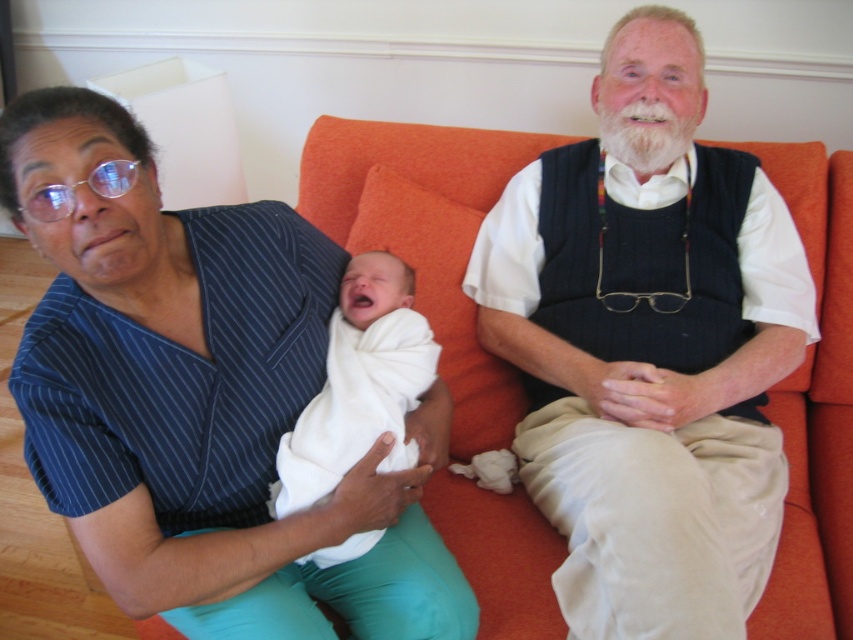
You are a photographer taking a portrait of the blue striped shirt at upper left and the white knit vest at center. Which one is closer to the camera?

The blue striped shirt at upper left is in front of the white knit vest at center, so it is closer to the camera.

Based on the scene description, can you determine which object is bigger between the white knit vest at center and the white soft swaddle at center?

The white knit vest at center is larger in size than the white soft swaddle at center.

You are standing in the living room and want to locate the point at coordinate (201, 400). Which object is this point located on?

The point at coordinate (201, 400) is located on the blue striped shirt at upper left.